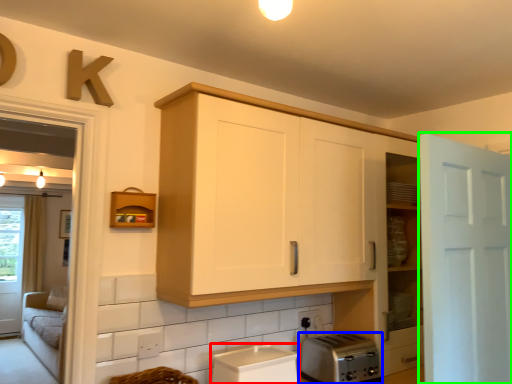
Question: Based on their relative distances, which object is farther from appliance (highlighted by a red box)? Choose from toaster (highlighted by a blue box) and door (highlighted by a green box).

Choices:
 (A) toaster
 (B) door

Answer: (B)